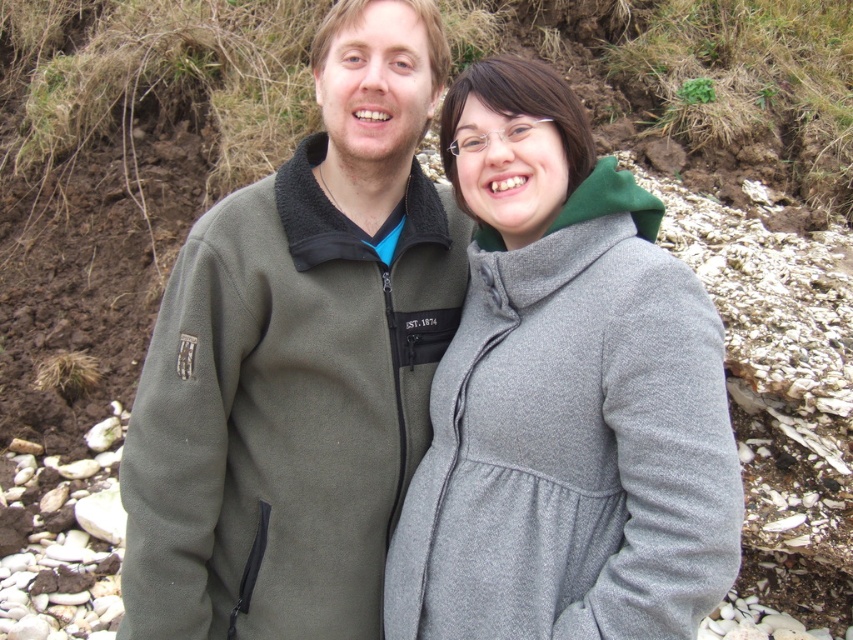
Question: Does green fleece jacket at center lie behind gray woolen coat at center?

Choices:
 (A) yes
 (B) no

Answer: (A)

Question: Is green fleece jacket at center below gray woolen coat at center?

Choices:
 (A) yes
 (B) no

Answer: (B)

Question: Can you confirm if green fleece jacket at center is positioned to the left of gray woolen coat at center?

Choices:
 (A) yes
 (B) no

Answer: (A)